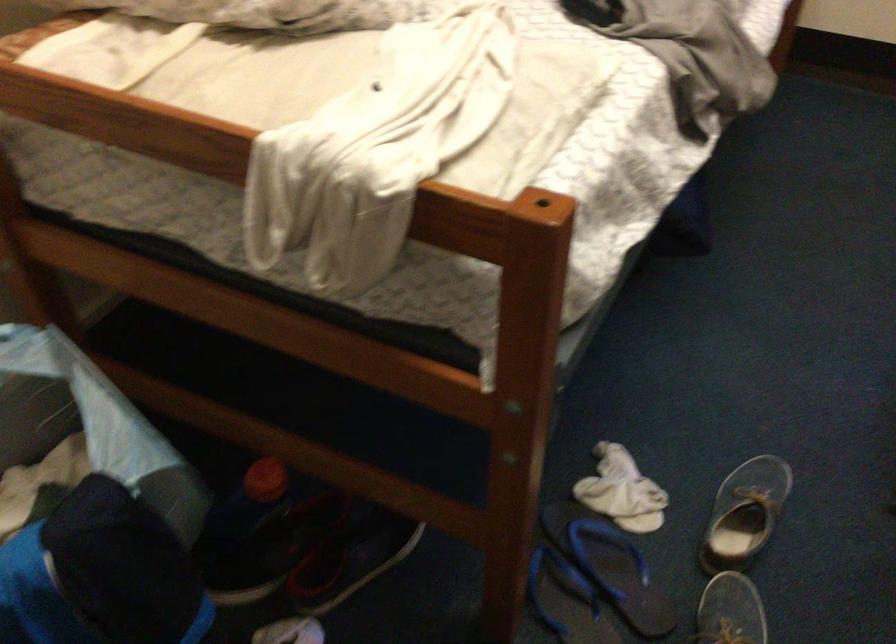
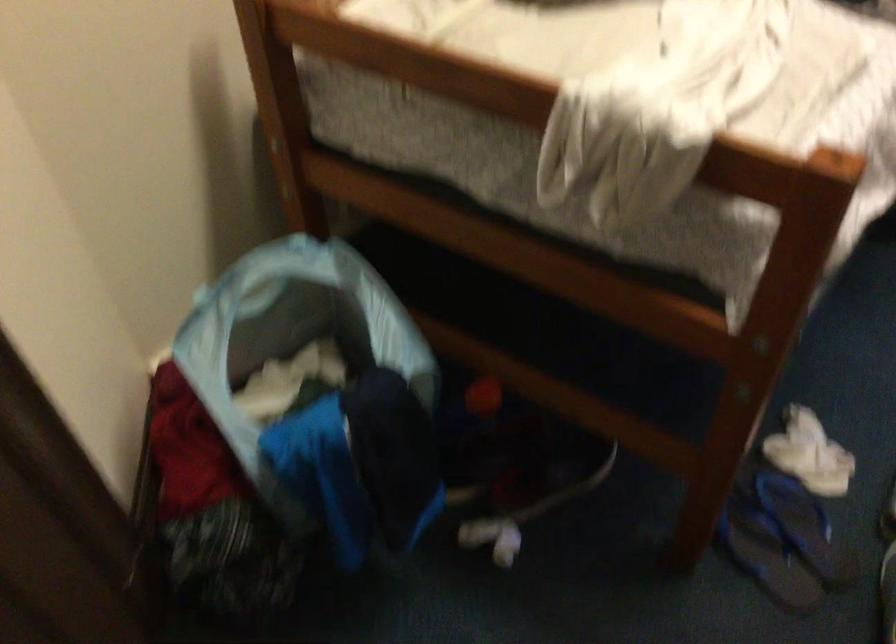
Question: Based on the continuous images, in which direction is the camera rotating? Reply with the corresponding letter.

Choices:
 (A) Left
 (B) Right
 (C) Up
 (D) Down

Answer: (A)